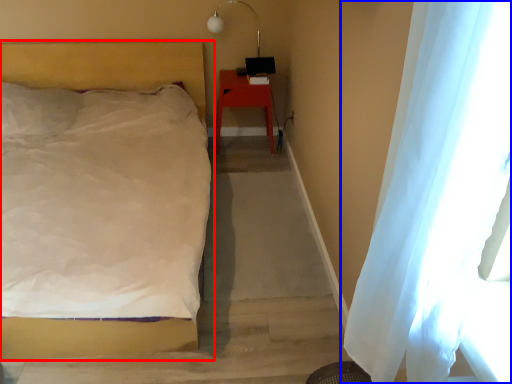
Question: Which object appears farthest to the camera in this image, bed (highlighted by a red box) or curtain (highlighted by a blue box)?

Choices:
 (A) bed
 (B) curtain

Answer: (A)